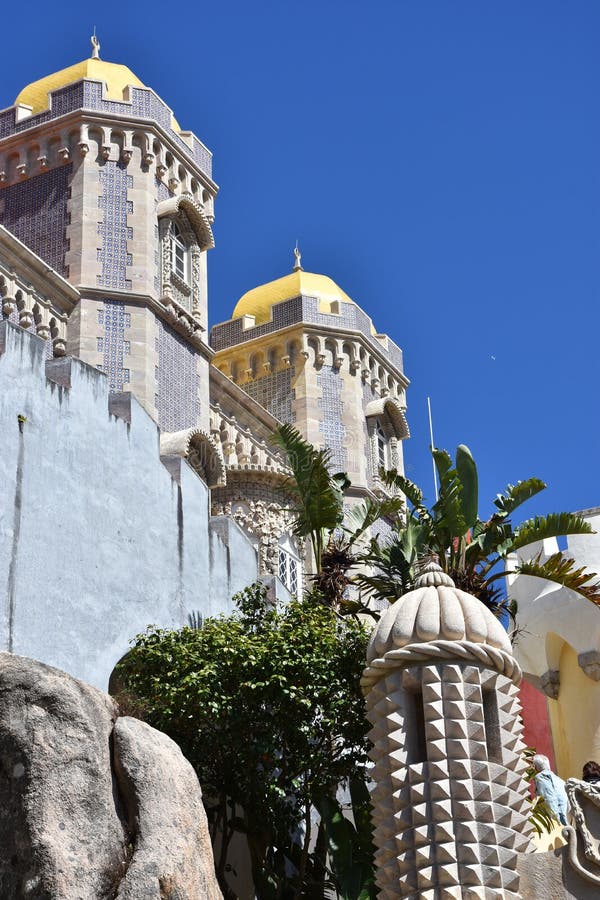
The height and width of the screenshot is (900, 600). In order to click on statue in this screenshot , I will do `click(589, 813)`.